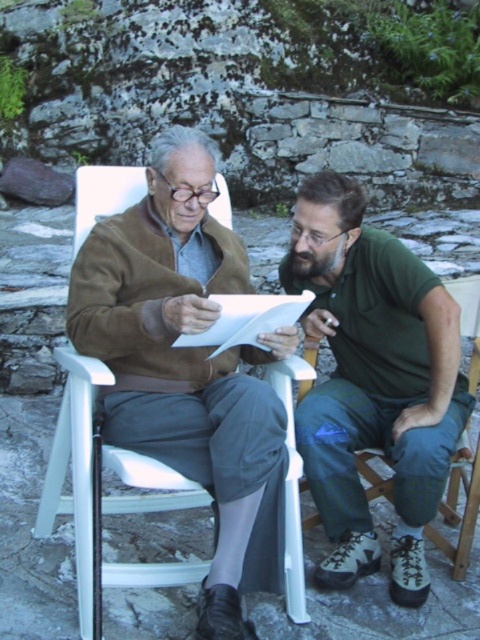
You are standing in the scene and want to hand a document to the person wearing the green fabric shirt at right. If your arm can reach 8 feet, will you be able to reach them without moving?

The green fabric shirt at right and viewer are 9.67 feet apart from each other. Since your arm can only reach 8 feet, you cannot reach them without moving closer.

You are standing in front of the two people in the image. You need to deliver a document to the person wearing the green fabric shirt at right. Which direction should you walk relative to the white plastic chair at center?

The green fabric shirt at right is to the right of the white plastic chair at center. Therefore, to reach the person wearing the green fabric shirt at right, you should walk to the right side of the white plastic chair at center.